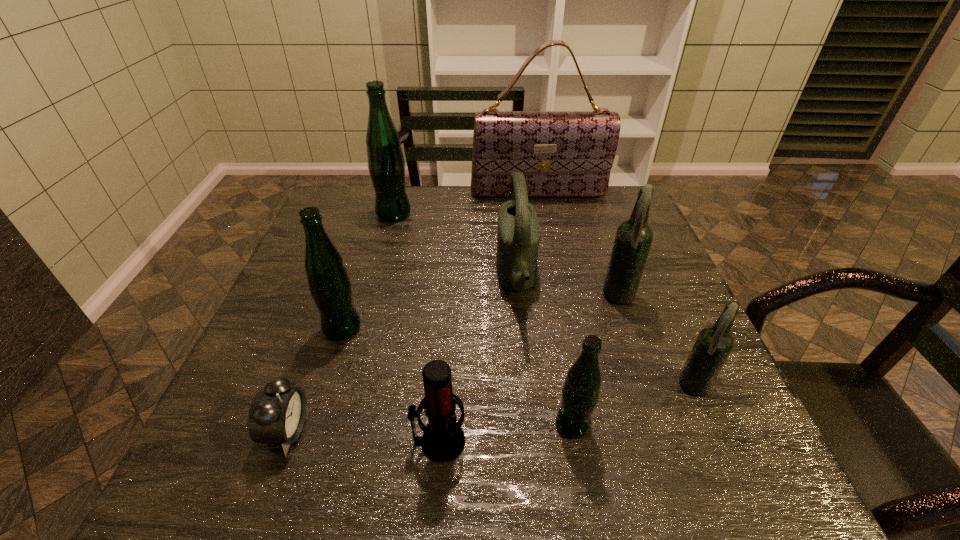
What are the coordinates of `vacant region located on the spout of the green watering can` in the screenshot? It's located at (372, 278).

Locate an element on the screen. vacant space positioned on the back of the rightmost beer bottle is located at coordinates (662, 315).

Locate an element on the screen. The width and height of the screenshot is (960, 540). free location located on the left of the rightmost green beer bottle is located at coordinates (421, 424).

You are a GUI agent. You are given a task and a screenshot of the screen. Output one action in this format:
    pyautogui.click(x=<x>, y=<y>)
    Task: Click on the vacant area located 0.300m on the back of the red microphone
    The width and height of the screenshot is (960, 540).
    Given the screenshot: What is the action you would take?
    click(449, 305)

Find the location of a particular element. This screenshot has width=960, height=540. vacant space located 0.160m on the front side of the alarm clock is located at coordinates (395, 431).

Where is `handbag positioned at the far edge`? The height and width of the screenshot is (540, 960). handbag positioned at the far edge is located at coordinates tap(561, 153).

The width and height of the screenshot is (960, 540). In order to click on beer bottle that is positioned at the far edge in this screenshot , I will do `click(386, 165)`.

Locate an element on the screen. microphone at the near edge is located at coordinates (443, 440).

Where is `alarm clock present at the near edge`? alarm clock present at the near edge is located at coordinates (277, 415).

I want to click on beer bottle situated at the left edge, so click(x=329, y=284).